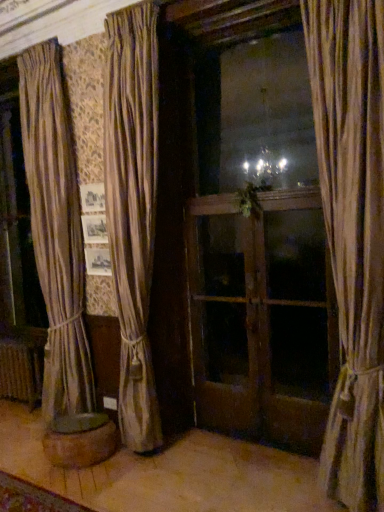
Measure the distance between wooden screen door at center, placed as the first screen door when sorted from left to right, and camera.

The depth of wooden screen door at center, placed as the first screen door when sorted from left to right, is 3.08 meters.

In order to face wooden screen door at center, marked as the 2th screen door in a right-to-left arrangement, should I rotate leftwards or rightwards?

Turn right approximately 4.311 degrees to face it.

Find the location of a particular element. The width and height of the screenshot is (384, 512). brown wood stool at lower left is located at coordinates (80, 440).

Where is `curtain that is the 2nd one when counting downward from the green leafy plant at center (from the image's perspective)`? This screenshot has width=384, height=512. curtain that is the 2nd one when counting downward from the green leafy plant at center (from the image's perspective) is located at coordinates (352, 233).

Is green leafy plant at center oriented away from beige fabric curtain at right, marked as the 1th curtain in a front-to-back arrangement?

No, green leafy plant at center's orientation is not away from beige fabric curtain at right, marked as the 1th curtain in a front-to-back arrangement.

Considering the sizes of green leafy plant at center and beige fabric curtain at right, marked as the 1th curtain in a front-to-back arrangement, in the image, is green leafy plant at center taller or shorter than beige fabric curtain at right, marked as the 1th curtain in a front-to-back arrangement,?

green leafy plant at center is shorter than beige fabric curtain at right, marked as the 1th curtain in a front-to-back arrangement.

Is there a large distance between green leafy plant at center and beige fabric curtain at right, the second curtain positioned from the left?

green leafy plant at center is positioned a significant distance from beige fabric curtain at right, the second curtain positioned from the left.

Which is nearer, (x=293, y=222) or (x=29, y=383)?

Clearly, point (x=293, y=222) is closer to the camera than point (x=29, y=383).

Is wooden screen door at center, which is the 2th screen door in left-to-right order, aimed at rustic metal radiator at lower left?

No, wooden screen door at center, which is the 2th screen door in left-to-right order, does not turn towards rustic metal radiator at lower left.

Between wooden screen door at center, which is the 2th screen door in left-to-right order, and rustic metal radiator at lower left, which one is positioned in front?

Positioned in front is wooden screen door at center, which is the 2th screen door in left-to-right order.

In terms of height, does wooden screen door at center, positioned as the first screen door in right-to-left order, look taller or shorter compared to rustic metal radiator at lower left?

Clearly, wooden screen door at center, positioned as the first screen door in right-to-left order, is taller compared to rustic metal radiator at lower left.

Which of these two, silky beige curtain at center, which ranks as the 1th curtain in back-to-front order, or green leafy plant at center, is wider?

Wider between the two is silky beige curtain at center, which ranks as the 1th curtain in back-to-front order.

Consider the image. From a real-world perspective, is silky beige curtain at center, which ranks as the 1th curtain in back-to-front order, positioned over green leafy plant at center based on gravity?

No.

Are silky beige curtain at center, which appears as the 2th curtain when viewed from the right, and green leafy plant at center far apart?

Yes.

Is silky beige curtain at center, arranged as the 2th curtain when viewed from the front, not close to beige fabric curtain at right, the second curtain positioned from the left?

Yes, silky beige curtain at center, arranged as the 2th curtain when viewed from the front, and beige fabric curtain at right, the second curtain positioned from the left, are located far from each other.

Consider the image. From the image's perspective, is silky beige curtain at center, which ranks as the 1th curtain in back-to-front order, over beige fabric curtain at right, marked as the 1th curtain in a front-to-back arrangement?

Yes, from the image's perspective, silky beige curtain at center, which ranks as the 1th curtain in back-to-front order, is over beige fabric curtain at right, marked as the 1th curtain in a front-to-back arrangement.

Can you confirm if silky beige curtain at center, arranged as the 2th curtain when viewed from the front, is smaller than beige fabric curtain at right, the second curtain positioned from the left?

No, silky beige curtain at center, arranged as the 2th curtain when viewed from the front, is not smaller than beige fabric curtain at right, the second curtain positioned from the left.

Does point (383, 139) appear closer or farther from the camera than point (149, 162)?

Point (383, 139) appears to be closer to the viewer than point (149, 162).

From the image's perspective, which one is positioned lower, beige fabric curtain at right, which is the 2th curtain from back to front, or silky beige curtain at center, which is the first curtain in left-to-right order?

beige fabric curtain at right, which is the 2th curtain from back to front.

Are beige fabric curtain at right, marked as the 1th curtain in a front-to-back arrangement, and silky beige curtain at center, which is the first curtain in left-to-right order, located far from each other?

Absolutely, beige fabric curtain at right, marked as the 1th curtain in a front-to-back arrangement, is distant from silky beige curtain at center, which is the first curtain in left-to-right order.

Which object is further away from the camera, beige fabric curtain at right, which is the 2th curtain from back to front, or silky beige curtain at center, which appears as the 2th curtain when viewed from the right?

silky beige curtain at center, which appears as the 2th curtain when viewed from the right, is further from the camera.

Is rustic metal radiator at lower left inside or outside of wooden screen door at center, positioned as the first screen door in right-to-left order?

rustic metal radiator at lower left is spatially situated outside wooden screen door at center, positioned as the first screen door in right-to-left order.

Considering the points (32, 358) and (207, 314), which point is behind, point (32, 358) or point (207, 314)?

Point (207, 314)

From the image's perspective, which one is positioned higher, rustic metal radiator at lower left or wooden screen door at center, positioned as the first screen door in right-to-left order?

wooden screen door at center, positioned as the first screen door in right-to-left order, appears higher in the image.

Can you confirm if silky beige curtain at center, which appears as the 2th curtain when viewed from the right, is wider than rustic metal radiator at lower left?

Correct, the width of silky beige curtain at center, which appears as the 2th curtain when viewed from the right, exceeds that of rustic metal radiator at lower left.

Could you tell me if silky beige curtain at center, which is the first curtain in left-to-right order, is turned towards rustic metal radiator at lower left?

No, silky beige curtain at center, which is the first curtain in left-to-right order, is not oriented towards rustic metal radiator at lower left.

From the image's perspective, would you say silky beige curtain at center, which is the first curtain in left-to-right order, is positioned over rustic metal radiator at lower left?

Yes, from the image's perspective, silky beige curtain at center, which is the first curtain in left-to-right order, is on top of rustic metal radiator at lower left.

Where is `the 1st curtain to the right when counting from the rustic metal radiator at lower left`? the 1st curtain to the right when counting from the rustic metal radiator at lower left is located at coordinates (133, 208).

The height and width of the screenshot is (512, 384). In the image, there is a beige fabric curtain at right, the second curtain positioned from the left. Identify the location of plant above it (from the image's perspective). (249, 200).

Find the location of `screen door that is the 2nd object above the rustic metal radiator at lower left (from a real-world perspective)`. screen door that is the 2nd object above the rustic metal radiator at lower left (from a real-world perspective) is located at coordinates (262, 317).

Estimate the real-world distances between objects in this image. Which object is closer to wooden screen door at center, which is the 2th screen door in left-to-right order, green leafy plant at center or beige fabric curtain at right, marked as the 1th curtain in a front-to-back arrangement?

Based on the image, green leafy plant at center appears to be nearer to wooden screen door at center, which is the 2th screen door in left-to-right order.

Based on their spatial positions, is wooden screen door at center, marked as the 2th screen door in a right-to-left arrangement, or green leafy plant at center closer to rustic metal radiator at lower left?

The object closer to rustic metal radiator at lower left is wooden screen door at center, marked as the 2th screen door in a right-to-left arrangement.

From the image, which object appears to be farther from rustic metal radiator at lower left, brown wood stool at lower left or beige fabric curtain at right, which is the 2th curtain from back to front?

Among the two, beige fabric curtain at right, which is the 2th curtain from back to front, is located further to rustic metal radiator at lower left.

Which object lies further to the anchor point wooden screen door at center, marked as the 2th screen door in a right-to-left arrangement, brown wood stool at lower left or green leafy plant at center?

brown wood stool at lower left is further to wooden screen door at center, marked as the 2th screen door in a right-to-left arrangement.

When comparing their distances from green leafy plant at center, does wooden screen door at center, marked as the 2th screen door in a right-to-left arrangement, or rustic metal radiator at lower left seem further?

rustic metal radiator at lower left lies further to green leafy plant at center than the other object.

Based on their spatial positions, is wooden screen door at center, which is the 2th screen door in left-to-right order, or green leafy plant at center closer to brown wood stool at lower left?

wooden screen door at center, which is the 2th screen door in left-to-right order, is closer to brown wood stool at lower left.

From the image, which object appears to be farther from green leafy plant at center, wooden screen door at center, marked as the 2th screen door in a right-to-left arrangement, or brown wood stool at lower left?

brown wood stool at lower left is positioned further to the anchor green leafy plant at center.

From the image, which object appears to be farther from wooden screen door at center, placed as the first screen door when sorted from left to right, brown wood stool at lower left or wooden screen door at center, which is the 2th screen door in left-to-right order?

brown wood stool at lower left.

Locate an element on the screen. The image size is (384, 512). plant between rustic metal radiator at lower left and beige fabric curtain at right, which is the 2th curtain from back to front is located at coordinates (249, 200).

This screenshot has width=384, height=512. In order to click on curtain between rustic metal radiator at lower left and wooden screen door at center, placed as the first screen door when sorted from left to right, in the horizontal direction in this screenshot , I will do `click(133, 208)`.

Locate an element on the screen. screen door between green leafy plant at center and wooden screen door at center, placed as the first screen door when sorted from left to right, in the vertical direction is located at coordinates 262,317.

Where is `plant between rustic metal radiator at lower left and wooden screen door at center, positioned as the first screen door in right-to-left order, from left to right`? plant between rustic metal radiator at lower left and wooden screen door at center, positioned as the first screen door in right-to-left order, from left to right is located at coordinates (249, 200).